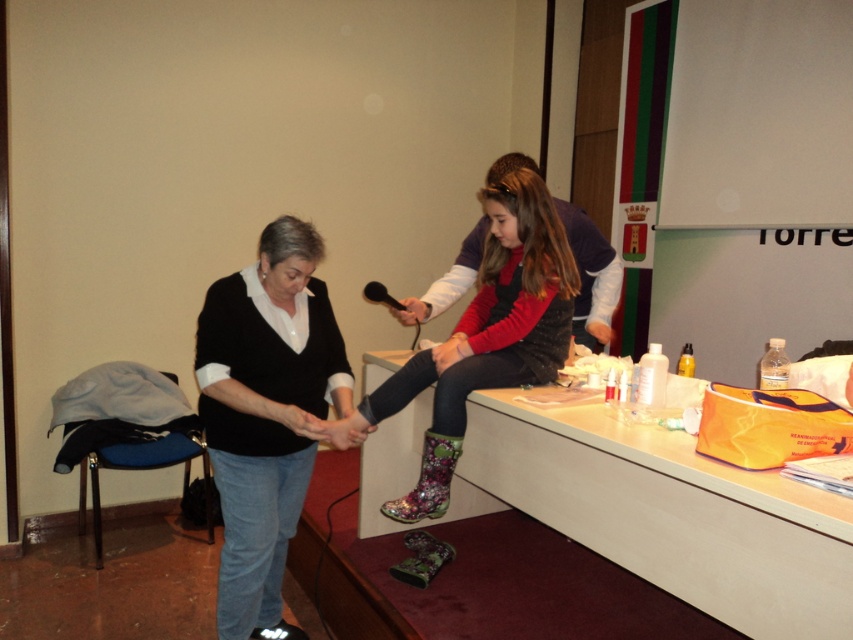
Based on the scene description, where is the matte black hand at lower center located in the image coordinates?

The matte black hand at lower center is located at point coordinates of (x=300, y=420).